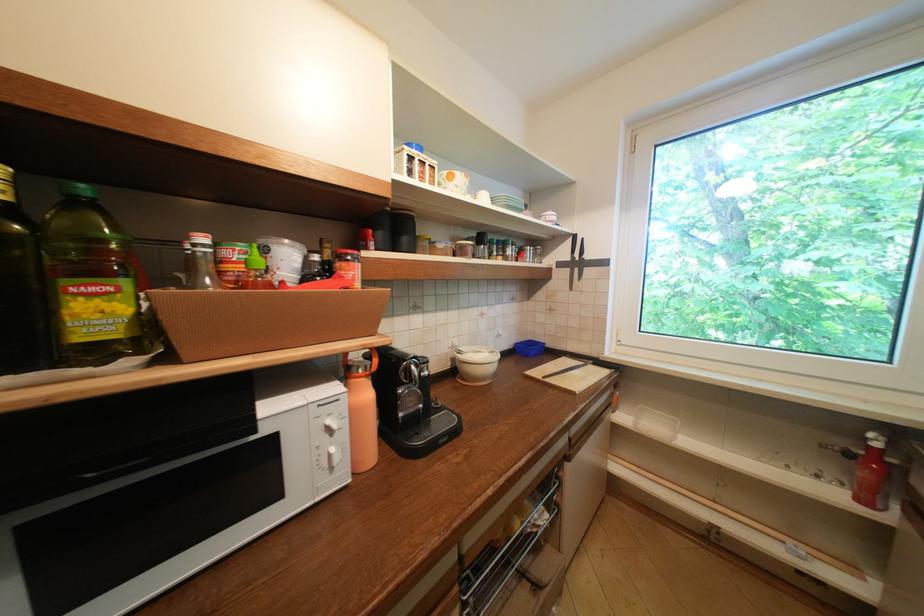
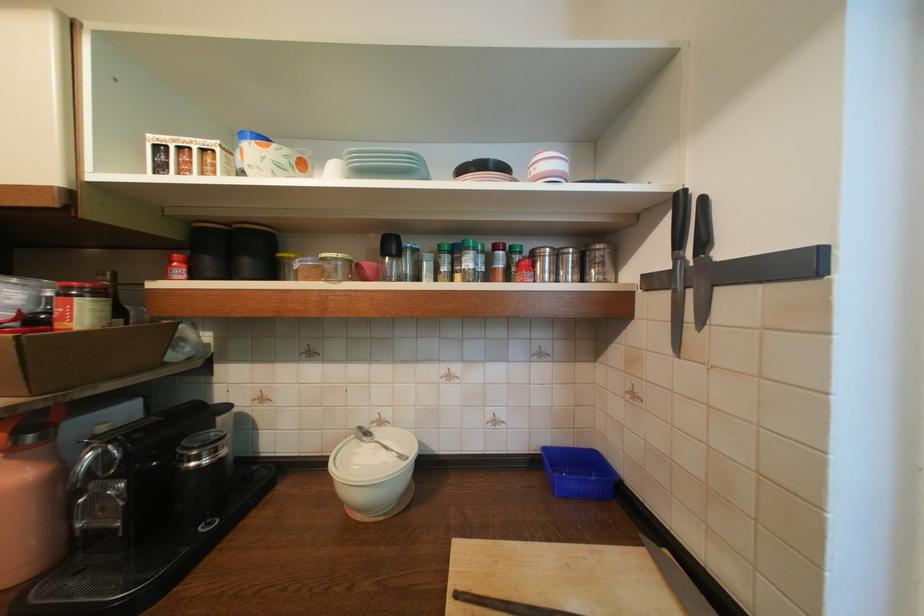
The point at (538, 251) is marked in the first image. Where is the corresponding point in the second image?

(565, 256)